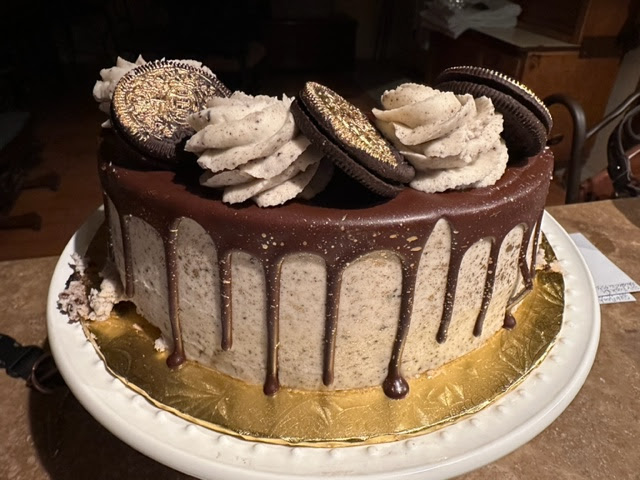
At what (x,y) coordinates should I click in order to perform the action: click on plate. Please return your answer as a coordinate pair (x, y). Looking at the image, I should click on (140, 432).